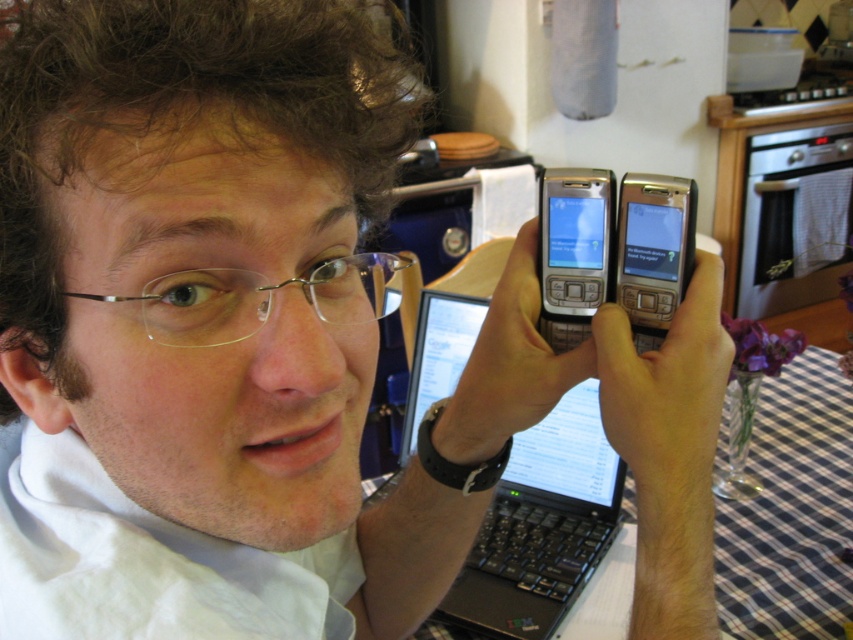
Question: Does black plastic laptop at center come in front of clear plastic glasses at center?

Choices:
 (A) yes
 (B) no

Answer: (B)

Question: Does silver metallic phone at upper center appear over silver metallic smartphone at center?

Choices:
 (A) yes
 (B) no

Answer: (A)

Question: Can you confirm if black plastic laptop at center is positioned above silver metallic smartphone at center?

Choices:
 (A) no
 (B) yes

Answer: (A)

Question: Which object is positioned farthest from the clear plastic glasses at center?

Choices:
 (A) silver metallic phone at upper center
 (B) silver metallic smartphone at center

Answer: (B)

Question: Which of the following is the farthest from the observer?

Choices:
 (A) (561, 204)
 (B) (223, 300)
 (C) (631, 196)

Answer: (A)

Question: Which point is farther to the camera?

Choices:
 (A) (451, 609)
 (B) (634, 340)
 (C) (547, 179)

Answer: (A)